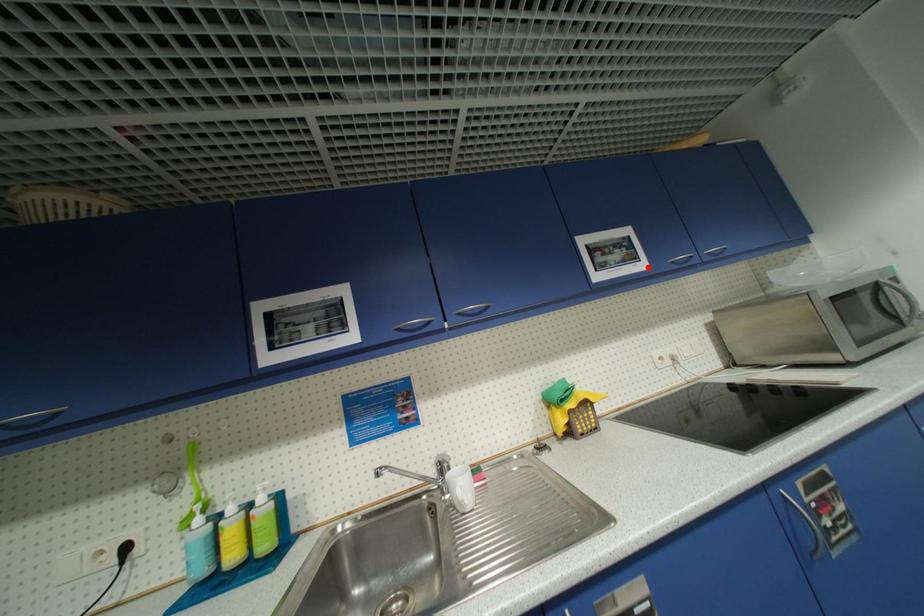
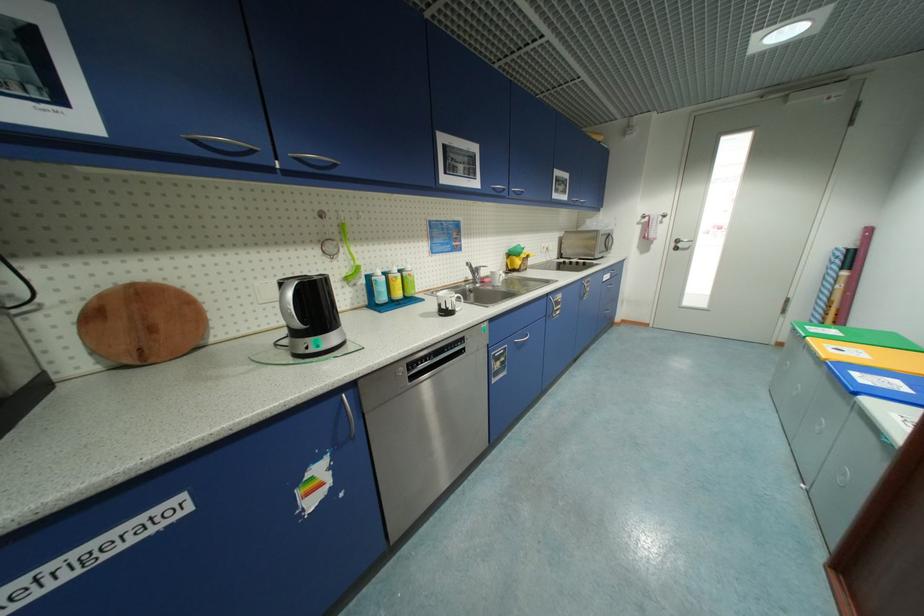
Question: I am providing you with two images of the same scene from different viewpoints. In image1, a red point is highlighted. Considering the same 3D point in image2, which of the following is correct?

Choices:
 (A) It is closer
 (B) It is farther

Answer: (A)